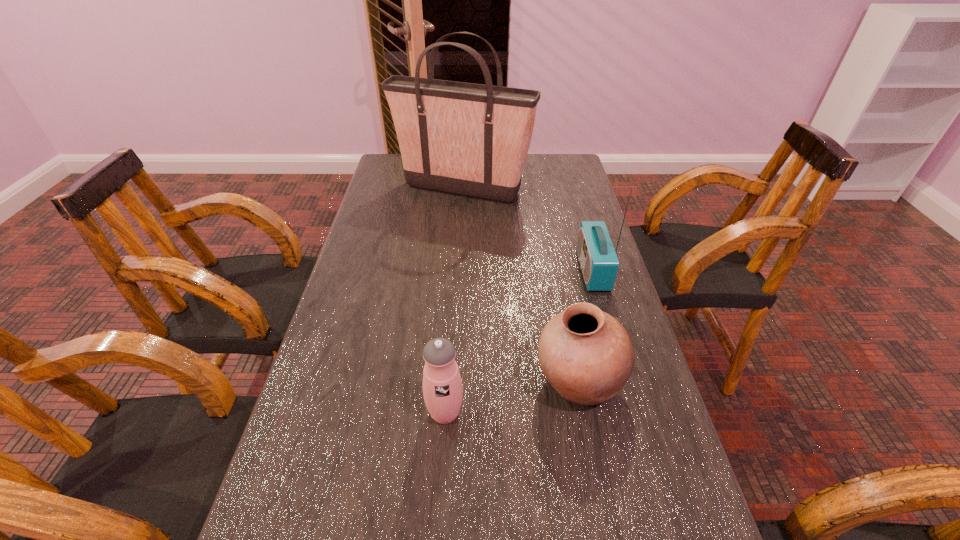
You are a GUI agent. You are given a task and a screenshot of the screen. Output one action in this format:
    pyautogui.click(x=<x>, y=<y>)
    Task: Click on the vacant area between the second farthest object and the farthest object
    This screenshot has width=960, height=540.
    Given the screenshot: What is the action you would take?
    pyautogui.click(x=527, y=230)

This screenshot has height=540, width=960. Identify the location of vacant area that lies between the radio receiver and the thermos bottle. (518, 341).

Image resolution: width=960 pixels, height=540 pixels. Identify the location of free space between the thermos bottle and the farthest object. (453, 301).

You are a GUI agent. You are given a task and a screenshot of the screen. Output one action in this format:
    pyautogui.click(x=<x>, y=<y>)
    Task: Click on the vacant area that lies between the tallest object and the thermos bottle
    The image size is (960, 540).
    Given the screenshot: What is the action you would take?
    pyautogui.click(x=453, y=301)

Identify the location of vacant area between the third shortest object and the shopping bag. The image size is (960, 540). (527, 230).

Where is `object that stands as the closest to the radio receiver`? object that stands as the closest to the radio receiver is located at coordinates pos(586,355).

Identify which object is the second nearest to the pottery. Please provide its 2D coordinates. Your answer should be formatted as a tuple, i.e. [(x, y)], where the tuple contains the x and y coordinates of a point satisfying the conditions above.

[(599, 263)]

Locate an element on the screen. Image resolution: width=960 pixels, height=540 pixels. vacant space that satisfies the following two spatial constraints: 1. on the back side of the pottery; 2. on the left side of the thermos bottle is located at coordinates (447, 381).